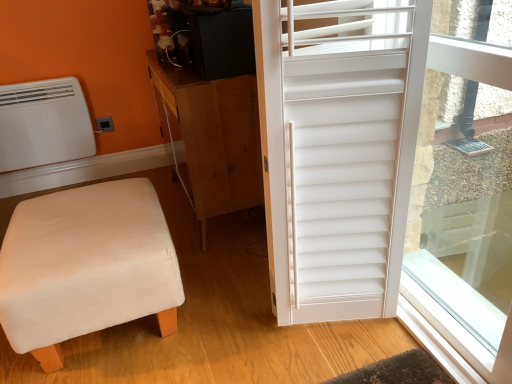
Question: Considering the relative sizes of brown wood cabinet at center and white matte shutter at right in the image provided, is brown wood cabinet at center taller than white matte shutter at right?

Choices:
 (A) no
 (B) yes

Answer: (A)

Question: From the image's perspective, is brown wood cabinet at center located above white matte shutter at right?

Choices:
 (A) no
 (B) yes

Answer: (B)

Question: Considering the relative sizes of brown wood cabinet at center and white matte shutter at right in the image provided, is brown wood cabinet at center wider than white matte shutter at right?

Choices:
 (A) yes
 (B) no

Answer: (B)

Question: Could white matte shutter at right be considered to be inside brown wood cabinet at center?

Choices:
 (A) no
 (B) yes

Answer: (A)

Question: From the image's perspective, does brown wood cabinet at center appear lower than white matte shutter at right?

Choices:
 (A) no
 (B) yes

Answer: (A)

Question: Is brown wood cabinet at center thinner than white matte shutter at right?

Choices:
 (A) yes
 (B) no

Answer: (A)

Question: Does white matte air conditioner at upper left lie behind beige fabric stool at lower left?

Choices:
 (A) yes
 (B) no

Answer: (A)

Question: From a real-world perspective, is white matte air conditioner at upper left located beneath beige fabric stool at lower left?

Choices:
 (A) yes
 (B) no

Answer: (B)

Question: Does white matte air conditioner at upper left have a larger size compared to beige fabric stool at lower left?

Choices:
 (A) yes
 (B) no

Answer: (B)

Question: Can you confirm if white matte air conditioner at upper left is taller than beige fabric stool at lower left?

Choices:
 (A) yes
 (B) no

Answer: (A)

Question: Is white matte air conditioner at upper left aimed at beige fabric stool at lower left?

Choices:
 (A) yes
 (B) no

Answer: (A)

Question: Does white matte air conditioner at upper left appear on the right side of beige fabric stool at lower left?

Choices:
 (A) yes
 (B) no

Answer: (B)

Question: Is white matte air conditioner at upper left not inside white matte window screen at right?

Choices:
 (A) no
 (B) yes

Answer: (B)